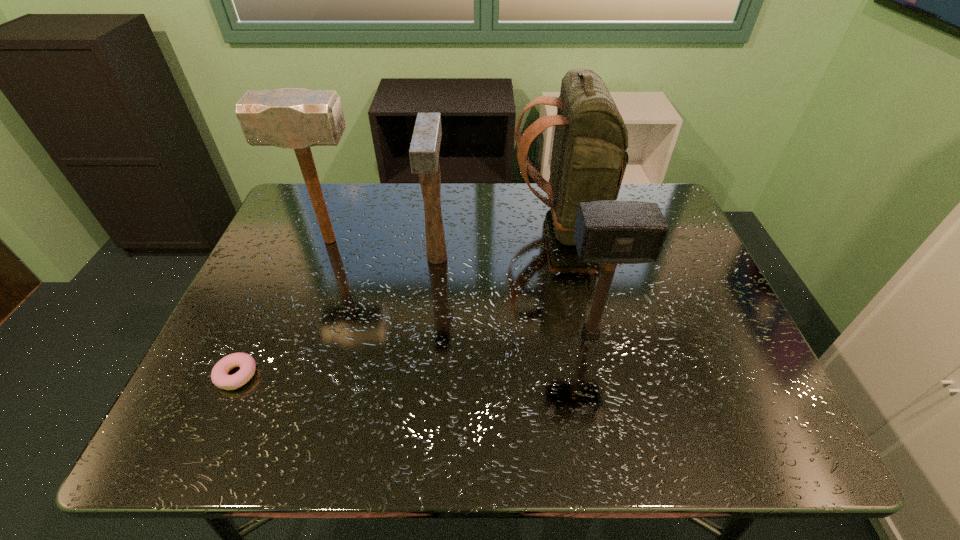
Where is `vacant space at the near edge of the desktop`? The image size is (960, 540). vacant space at the near edge of the desktop is located at coordinates (420, 414).

In the image, there is a desktop. Identify the location of vacant space at the left edge. (319, 261).

Identify the location of blank space at the right edge of the desktop. (681, 365).

You are a GUI agent. You are given a task and a screenshot of the screen. Output one action in this format:
    pyautogui.click(x=<x>, y=<y>)
    Task: Click on the free spot at the near left corner of the desktop
    The width and height of the screenshot is (960, 540).
    Given the screenshot: What is the action you would take?
    pyautogui.click(x=187, y=426)

Identify the location of vacant space at the near right corner of the desktop. (777, 437).

I want to click on empty location between the third object from right to left and the leftmost mallet, so click(x=384, y=249).

Locate an element on the screen. free point between the rightmost mallet and the doughnut is located at coordinates (414, 355).

This screenshot has width=960, height=540. What are the coordinates of `free space between the doughnut and the second mallet from left to right` in the screenshot? It's located at (337, 316).

Where is `free space between the leftmost mallet and the nearest object`? The width and height of the screenshot is (960, 540). free space between the leftmost mallet and the nearest object is located at coordinates tap(284, 308).

Where is `empty space between the nearest object and the rightmost mallet`? empty space between the nearest object and the rightmost mallet is located at coordinates pyautogui.click(x=414, y=355).